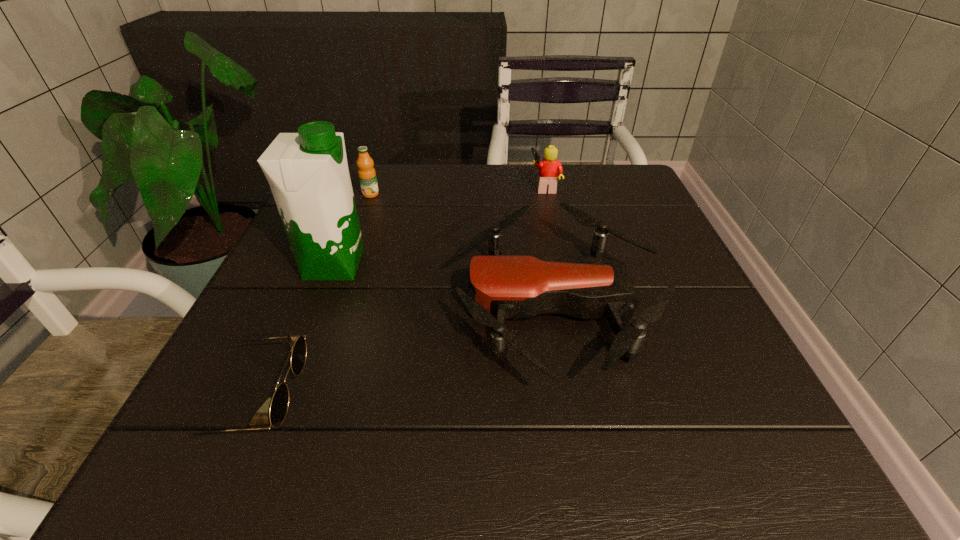
You are a GUI agent. You are given a task and a screenshot of the screen. Output one action in this format:
    pyautogui.click(x=<x>, y=<y>)
    Task: Click on the vacant area between the shortest object and the drone
    
    Given the screenshot: What is the action you would take?
    pyautogui.click(x=404, y=352)

Find the location of a particular element. The image size is (960, 540). vacant area between the Lego and the drone is located at coordinates (x=550, y=246).

Find the location of a particular element. The width and height of the screenshot is (960, 540). free spot between the shortest object and the soya milk is located at coordinates (294, 332).

The height and width of the screenshot is (540, 960). Find the location of `unoccupied position between the drone and the tallest object`. unoccupied position between the drone and the tallest object is located at coordinates (444, 285).

I want to click on vacant space that is in between the shortest object and the soya milk, so click(x=294, y=332).

At what (x,y) coordinates should I click in order to perform the action: click on free spot between the shortest object and the orange juice. Please return your answer as a coordinate pair (x, y). Looking at the image, I should click on (312, 297).

Where is `free space that is in between the drone and the Lego`? free space that is in between the drone and the Lego is located at coordinates (550, 246).

At what (x,y) coordinates should I click in order to perform the action: click on vacant space that's between the tallest object and the sunglasses. Please return your answer as a coordinate pair (x, y). Looking at the image, I should click on (294, 332).

Where is `object that is the closest to the drone`? Image resolution: width=960 pixels, height=540 pixels. object that is the closest to the drone is located at coordinates (549, 168).

Locate an element on the screen. This screenshot has height=540, width=960. object that is the fourth closest to the shortest object is located at coordinates (549, 168).